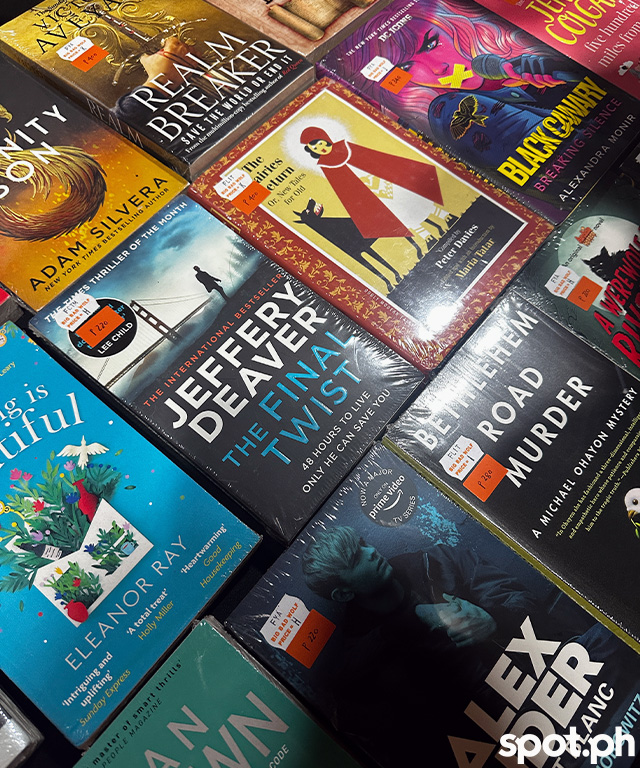
Identify the location of book. The image size is (640, 768). (105, 197).